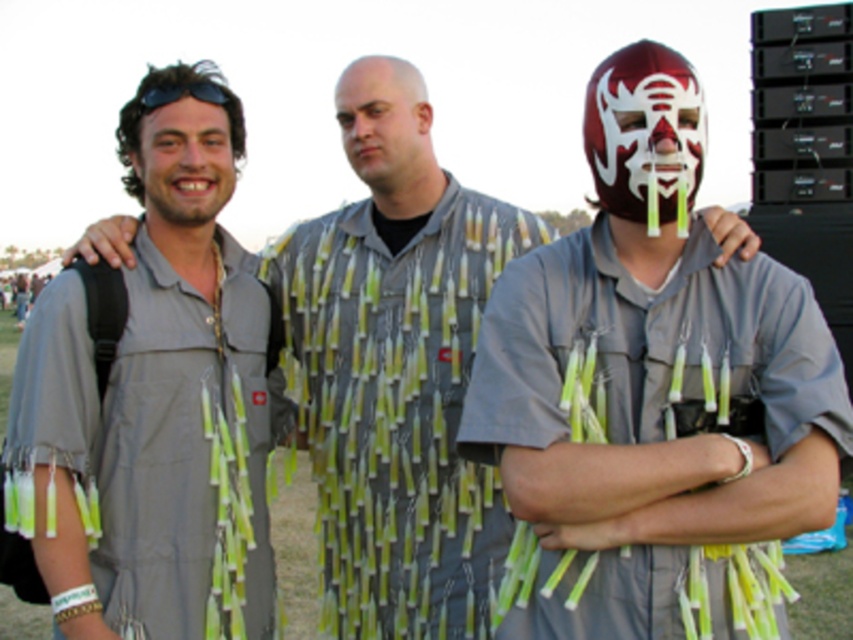
Can you confirm if matte gray shirt at left is wider than black matte sunglasses at upper left?

Indeed, matte gray shirt at left has a greater width compared to black matte sunglasses at upper left.

Who is lower down, matte gray shirt at left or black matte sunglasses at upper left?

Positioned lower is matte gray shirt at left.

Image resolution: width=853 pixels, height=640 pixels. What do you see at coordinates (184, 163) in the screenshot?
I see `matte gray shirt at left` at bounding box center [184, 163].

The image size is (853, 640). What are the coordinates of `matte gray shirt at left` in the screenshot? It's located at (184, 163).

Is matte gray shirt with tassels at center wider than gray fabric shirt at left?

Correct, the width of matte gray shirt with tassels at center exceeds that of gray fabric shirt at left.

Does matte gray shirt with tassels at center appear on the right side of gray fabric shirt at left?

Yes, matte gray shirt with tassels at center is to the right of gray fabric shirt at left.

Image resolution: width=853 pixels, height=640 pixels. What do you see at coordinates (653, 387) in the screenshot? I see `matte gray shirt with tassels at center` at bounding box center [653, 387].

Locate an element on the screen. Image resolution: width=853 pixels, height=640 pixels. matte gray shirt with tassels at center is located at coordinates (653, 387).

What do you see at coordinates (653, 387) in the screenshot? Image resolution: width=853 pixels, height=640 pixels. I see `matte gray shirt with tassels at center` at bounding box center [653, 387].

Is point (544, 609) positioned before point (225, 150)?

Yes, point (544, 609) is closer to viewer.

Which is in front, point (518, 452) or point (201, 156)?

Positioned in front is point (518, 452).

Locate an element on the screen. matte gray shirt with tassels at center is located at coordinates (653, 387).